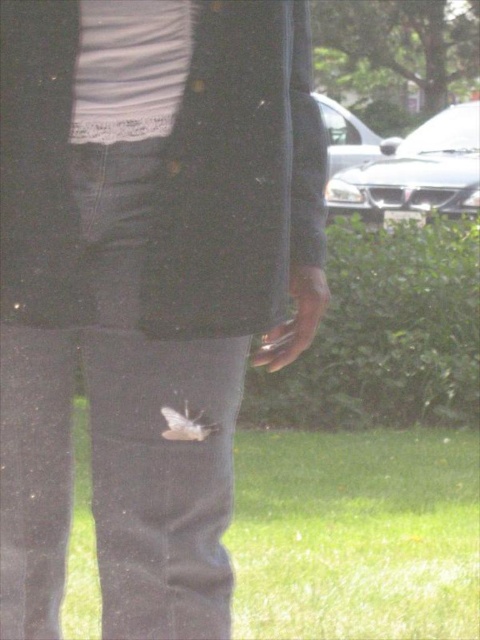
You are a photographer trying to capture a close shot of the white matte bird at center. However, your camera lens is currently focused on the smooth leather hand at center. Can you still get a clear photo of the bird without adjusting the focus?

The smooth leather hand at center is further to the viewer than the white matte bird at center, so if the camera is focused on the hand, the bird will be out of focus. You need to adjust the focus to the white matte bird at center to get a clear photo.